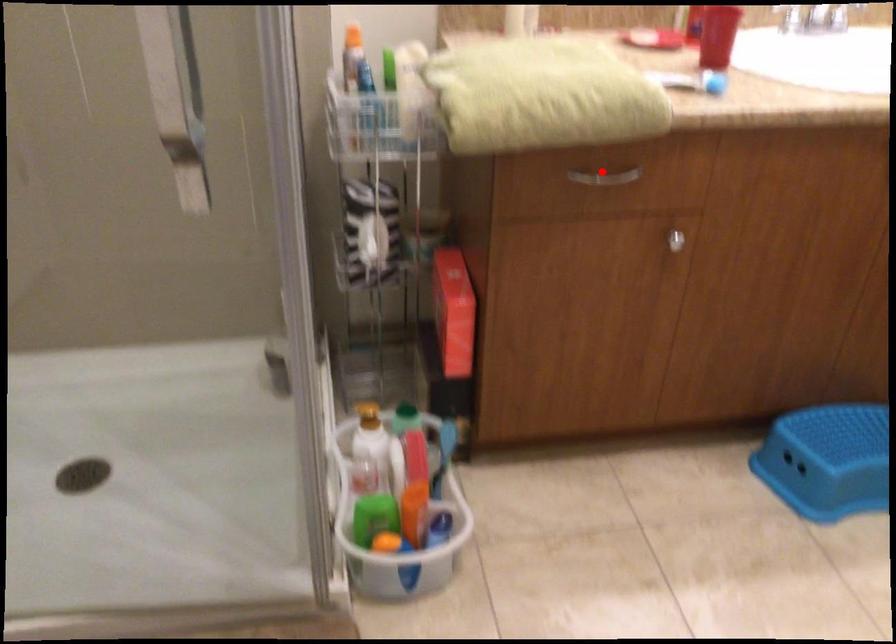
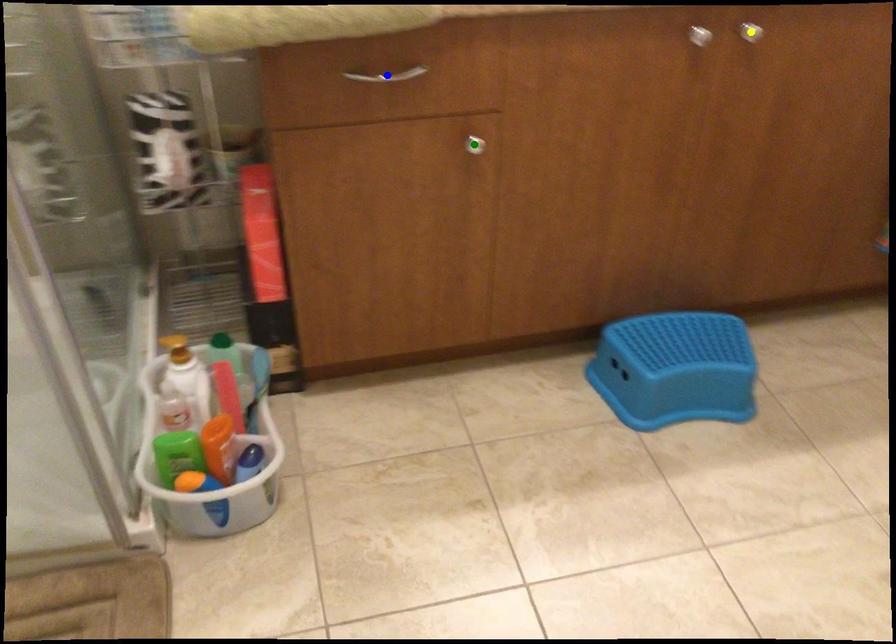
Question: I am providing you with two images of the same scene from different viewpoints. A red point is marked on the first image. You are given multiple points on the second image. In image 2, which mark is for the same physical point as the one in image 1?

Choices:
 (A) blue point
 (B) yellow point
 (C) green point

Answer: (A)